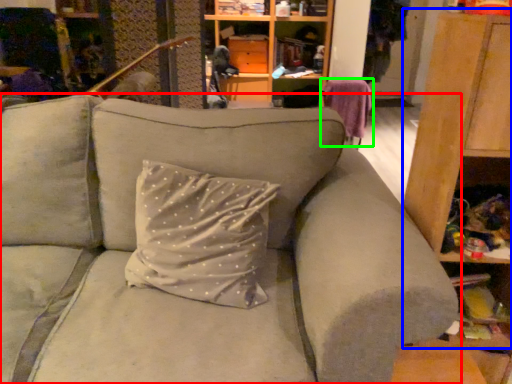
Question: Which object is positioned closest to studio couch (highlighted by a red box)? Select from dresser (highlighted by a blue box) and swivel chair (highlighted by a green box).

Choices:
 (A) dresser
 (B) swivel chair

Answer: (A)